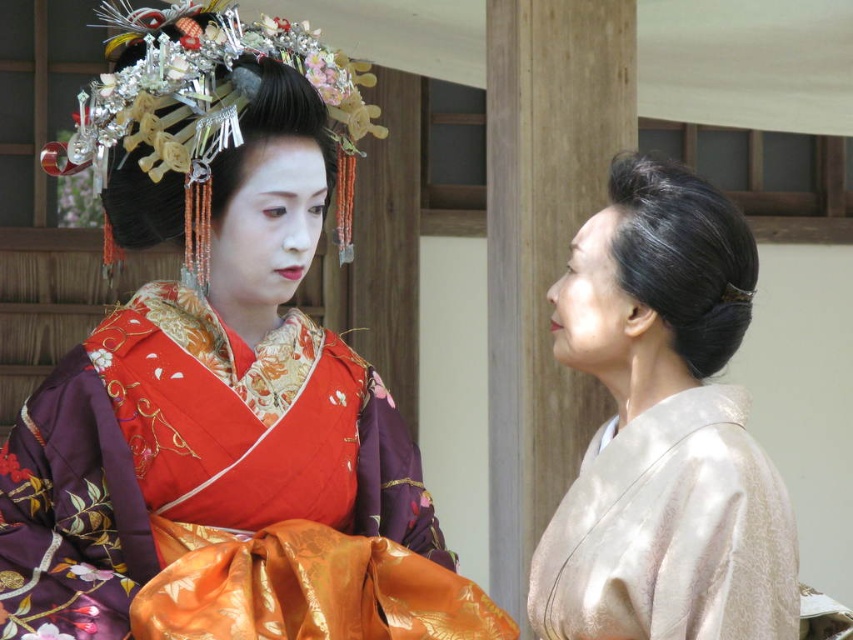
Question: Considering the relative positions of silky purple kimono at center and satin beige kimono at right in the image provided, where is silky purple kimono at center located with respect to satin beige kimono at right?

Choices:
 (A) left
 (B) right

Answer: (A)

Question: Among these objects, which one is nearest to the camera?

Choices:
 (A) silky purple kimono at center
 (B) satin beige kimono at right

Answer: (A)

Question: Does silky purple kimono at center lie in front of satin beige kimono at right?

Choices:
 (A) no
 (B) yes

Answer: (B)

Question: Among these points, which one is farthest from the camera?

Choices:
 (A) (339, 515)
 (B) (648, 330)

Answer: (A)

Question: Which object is farther from the camera taking this photo?

Choices:
 (A) silky purple kimono at center
 (B) satin beige kimono at right

Answer: (B)

Question: Can you confirm if silky purple kimono at center is positioned to the left of satin beige kimono at right?

Choices:
 (A) yes
 (B) no

Answer: (A)